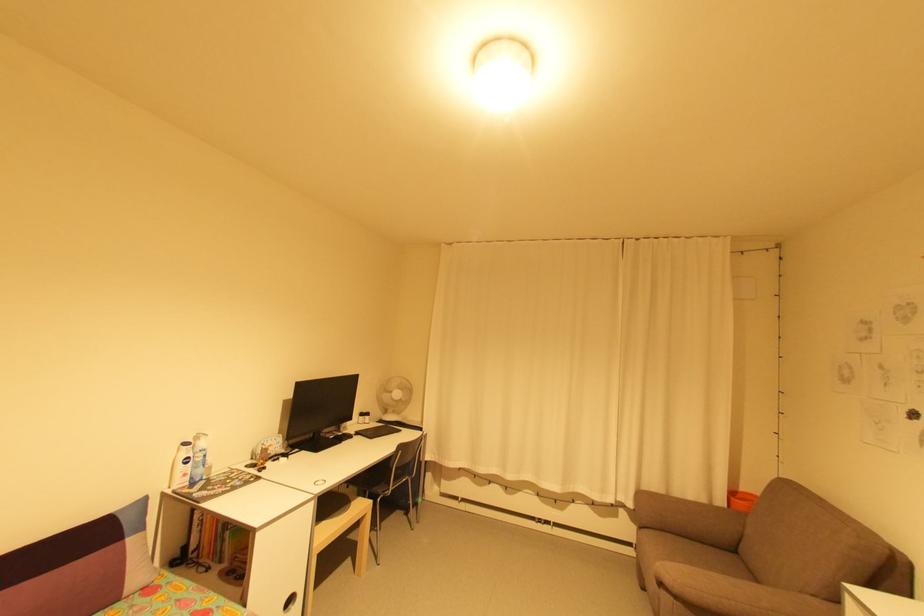
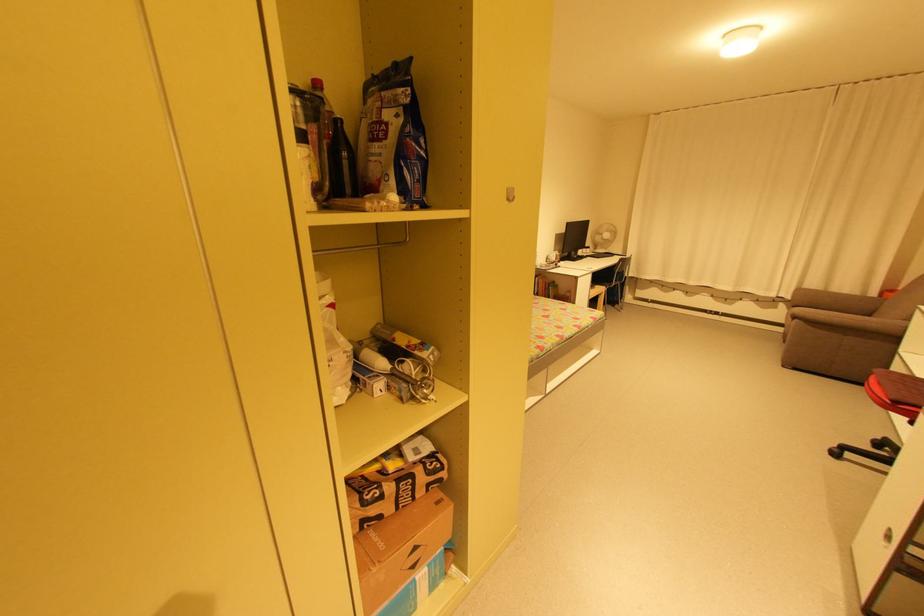
Where in the second image is the point corresponding to the point at 635,505 from the first image?

(794, 297)